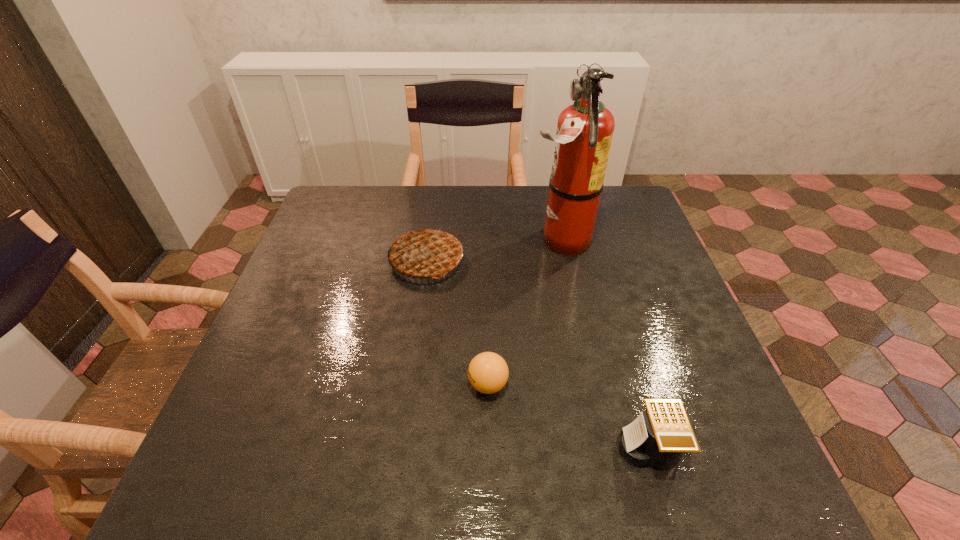
At what (x,y) coordinates should I click in order to perform the action: click on vacant space at the left edge of the desktop. Please return your answer as a coordinate pair (x, y). The image size is (960, 540). Looking at the image, I should click on (259, 415).

Locate an element on the screen. The width and height of the screenshot is (960, 540). vacant space at the right edge of the desktop is located at coordinates 644,291.

This screenshot has height=540, width=960. In the image, there is a desktop. Find the location of `vacant space at the far left corner`. vacant space at the far left corner is located at coordinates (320, 229).

The height and width of the screenshot is (540, 960). In the image, there is a desktop. In order to click on free space at the far right corner in this screenshot , I will do `click(613, 197)`.

What are the coordinates of `free space between the second nearest object and the tallest object` in the screenshot? It's located at (523, 312).

You are a GUI agent. You are given a task and a screenshot of the screen. Output one action in this format:
    pyautogui.click(x=<x>, y=<y>)
    Task: Click on the free space between the calculator and the fire extinguisher
    The height and width of the screenshot is (540, 960).
    Given the screenshot: What is the action you would take?
    pyautogui.click(x=604, y=345)

Locate an element on the screen. empty space that is in between the tallest object and the nearest object is located at coordinates 604,345.

I want to click on vacant point located between the ping-pong ball and the nearest object, so click(568, 416).

Image resolution: width=960 pixels, height=540 pixels. Find the location of `free space between the nearest object and the third farthest object`. free space between the nearest object and the third farthest object is located at coordinates (568, 416).

Identify the location of free space that is in between the second object from left to right and the fire extinguisher. coord(523,312).